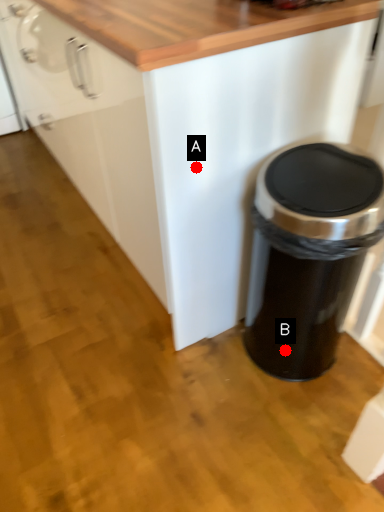
Question: Two points are circled on the image, labeled by A and B beside each circle. Which point is farther from the camera taking this photo?

Choices:
 (A) A is further
 (B) B is further

Answer: (B)